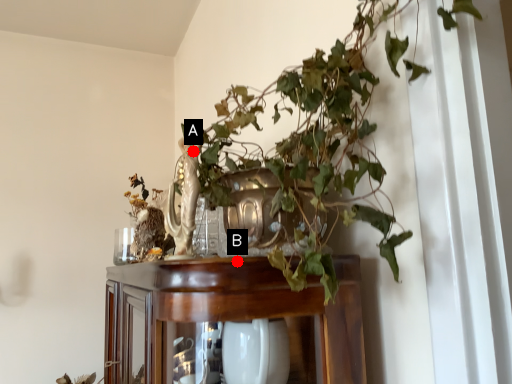
Question: Two points are circled on the image, labeled by A and B beside each circle. Which point is closer to the camera?

Choices:
 (A) A is closer
 (B) B is closer

Answer: (B)